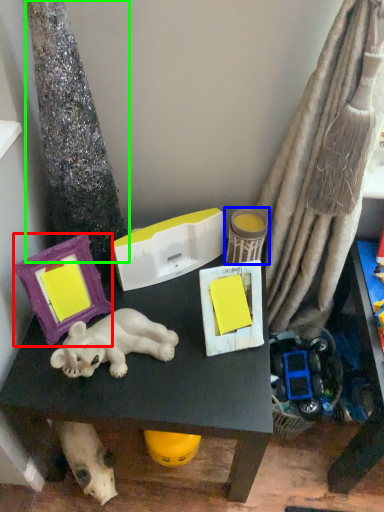
Question: Estimate the real-world distances between objects in this image. Which object is farther from picture frame (highlighted by a red box), toy (highlighted by a blue box) or tree trunk (highlighted by a green box)?

Choices:
 (A) toy
 (B) tree trunk

Answer: (A)